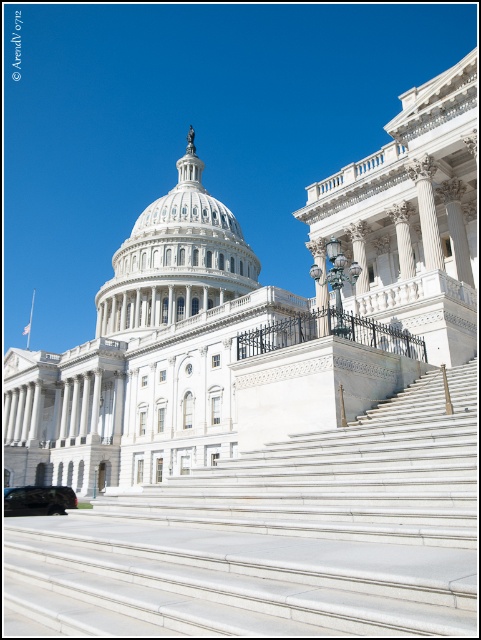
Who is positioned more to the right, black wrought iron railing at center or white marble column at upper center?

From the viewer's perspective, white marble column at upper center appears more on the right side.

Is the position of black wrought iron railing at center less distant than that of white marble column at upper center?

Yes, it is.

Between point (380, 330) and point (319, 262), which one is positioned behind?

Positioned behind is point (319, 262).

Locate an element on the screen. black wrought iron railing at center is located at coordinates (329, 333).

Is shiny black car at lower left shorter than white marble column at upper center?

Incorrect, shiny black car at lower left's height does not fall short of white marble column at upper center's.

Measure the distance between point (x=25, y=500) and camera.

Point (x=25, y=500) and camera are 40.59 meters apart from each other.

Where is `shiny black car at lower left`? The height and width of the screenshot is (640, 481). shiny black car at lower left is located at coordinates (37, 500).

Is white marble stairs at center smaller than white marble dome at center?

Indeed, white marble stairs at center has a smaller size compared to white marble dome at center.

Is white marble stairs at center taller than white marble dome at center?

In fact, white marble stairs at center may be shorter than white marble dome at center.

Describe the element at coordinates (276, 538) in the screenshot. Image resolution: width=481 pixels, height=640 pixels. I see `white marble stairs at center` at that location.

The height and width of the screenshot is (640, 481). Find the location of `white marble stairs at center`. white marble stairs at center is located at coordinates (276, 538).